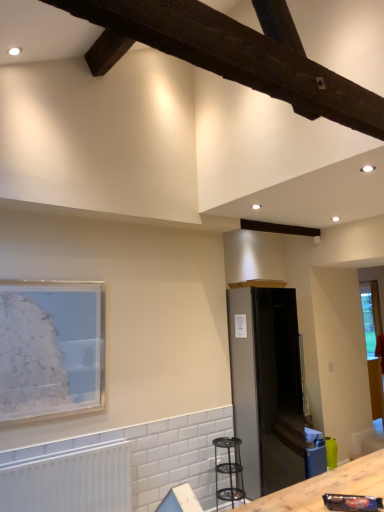
Question: Considering the relative sizes of dark brown wood at upper center and matte glass picture frame at left in the image provided, is dark brown wood at upper center wider than matte glass picture frame at left?

Choices:
 (A) no
 (B) yes

Answer: (B)

Question: Is dark brown wood at upper center in front of matte glass picture frame at left?

Choices:
 (A) no
 (B) yes

Answer: (B)

Question: Is dark brown wood at upper center next to matte glass picture frame at left?

Choices:
 (A) no
 (B) yes

Answer: (A)

Question: Would you say dark brown wood at upper center is outside matte glass picture frame at left?

Choices:
 (A) no
 (B) yes

Answer: (B)

Question: Can you confirm if dark brown wood at upper center is smaller than matte glass picture frame at left?

Choices:
 (A) no
 (B) yes

Answer: (A)

Question: Is there a large distance between dark brown wood at upper center and matte glass picture frame at left?

Choices:
 (A) no
 (B) yes

Answer: (B)

Question: Does white matte radiator at lower left appear on the left side of satin black refrigerator at center?

Choices:
 (A) no
 (B) yes

Answer: (B)

Question: Is white matte radiator at lower left taller than satin black refrigerator at center?

Choices:
 (A) no
 (B) yes

Answer: (A)

Question: Could you tell me if white matte radiator at lower left is facing satin black refrigerator at center?

Choices:
 (A) no
 (B) yes

Answer: (A)

Question: Can you confirm if white matte radiator at lower left is wider than satin black refrigerator at center?

Choices:
 (A) no
 (B) yes

Answer: (A)

Question: Can we say white matte radiator at lower left lies outside satin black refrigerator at center?

Choices:
 (A) no
 (B) yes

Answer: (B)

Question: Can you confirm if white matte radiator at lower left is bigger than satin black refrigerator at center?

Choices:
 (A) no
 (B) yes

Answer: (A)

Question: Can you confirm if matte glass picture frame at left is taller than dark brown wood at upper center?

Choices:
 (A) no
 (B) yes

Answer: (B)